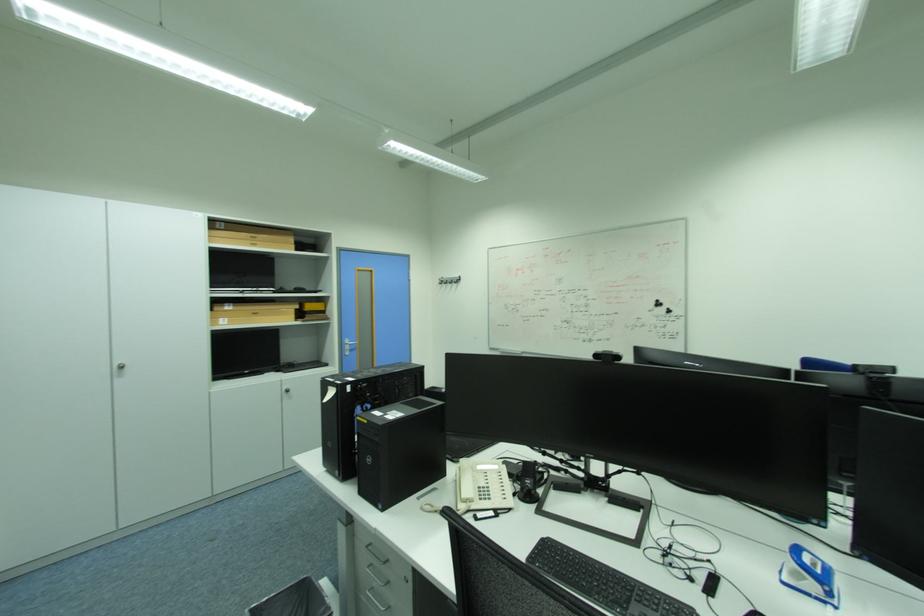
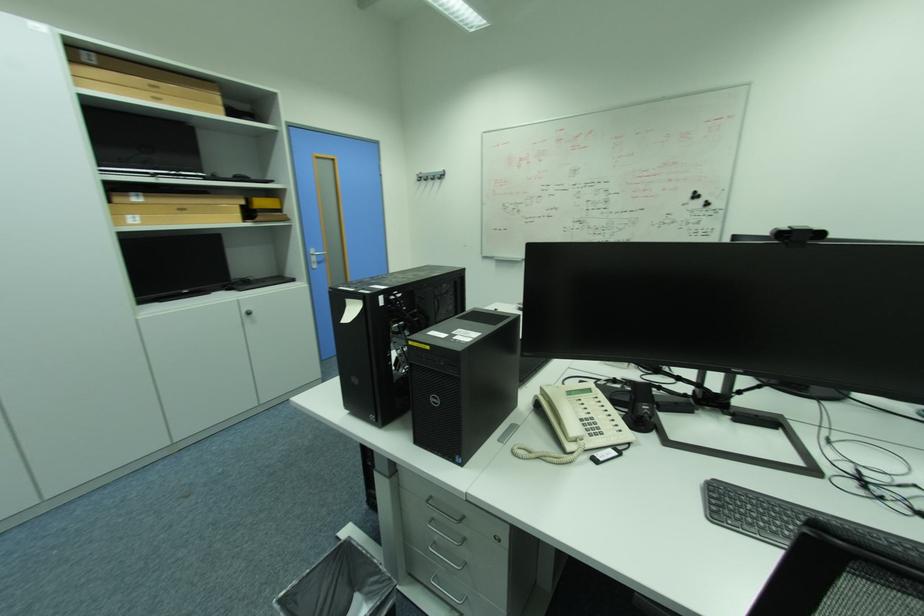
In the second image, find the point that corresponds to [445,282] in the first image.

(421, 179)